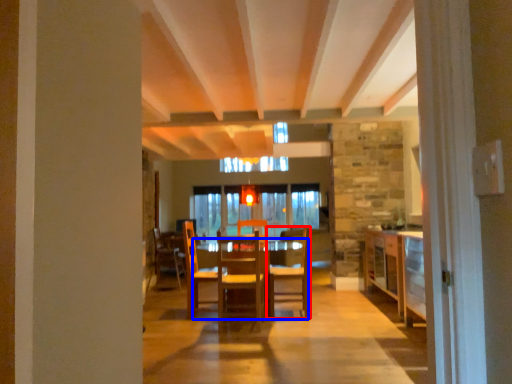
Question: Which object appears closest to the camera in this image, chair (highlighted by a red box) or table (highlighted by a blue box)?

Choices:
 (A) chair
 (B) table

Answer: (B)